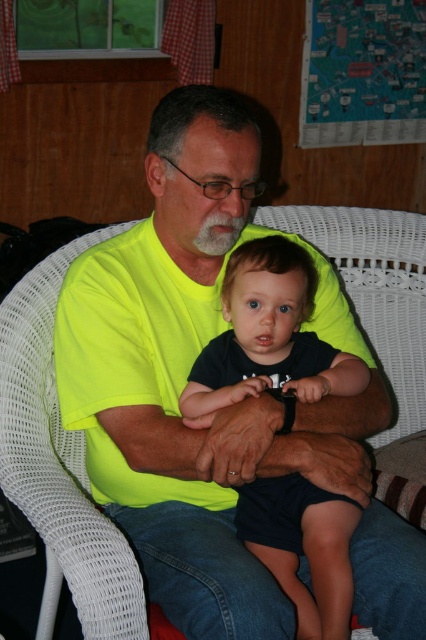
Which is above, neon yellow t-shirt at center or dark blue fabric at center?

neon yellow t-shirt at center is above.

Who is positioned more to the right, neon yellow t-shirt at center or dark blue fabric at center?

dark blue fabric at center

Between point (184, 476) and point (342, 532), which one is positioned behind?

Point (342, 532)

Identify the location of neon yellow t-shirt at center. (187, 372).